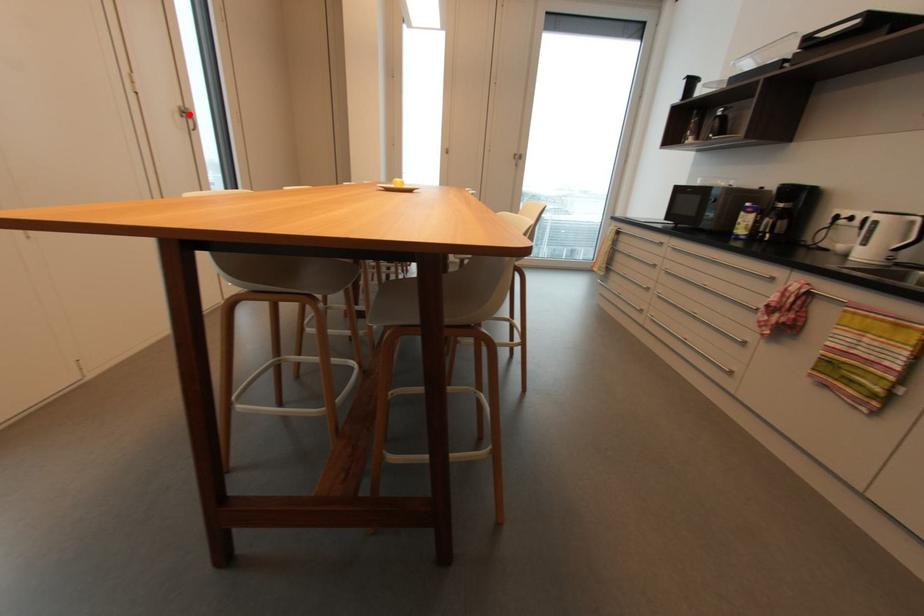
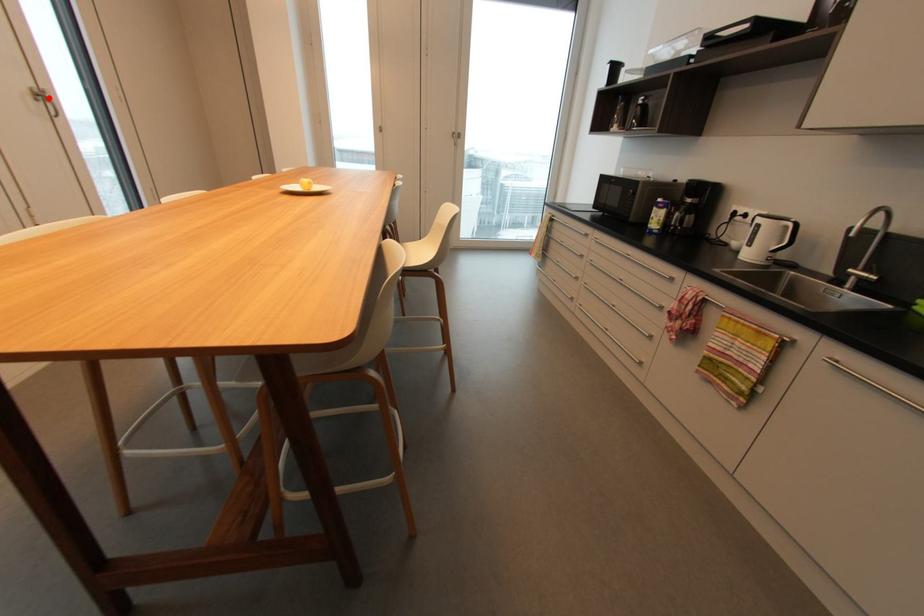
I am providing you with two images of the same scene from different viewpoints. A red point is marked on the first image and another point is marked on the second image. Are the points marked in image1 and image2 representing the same 3D position?

Yes